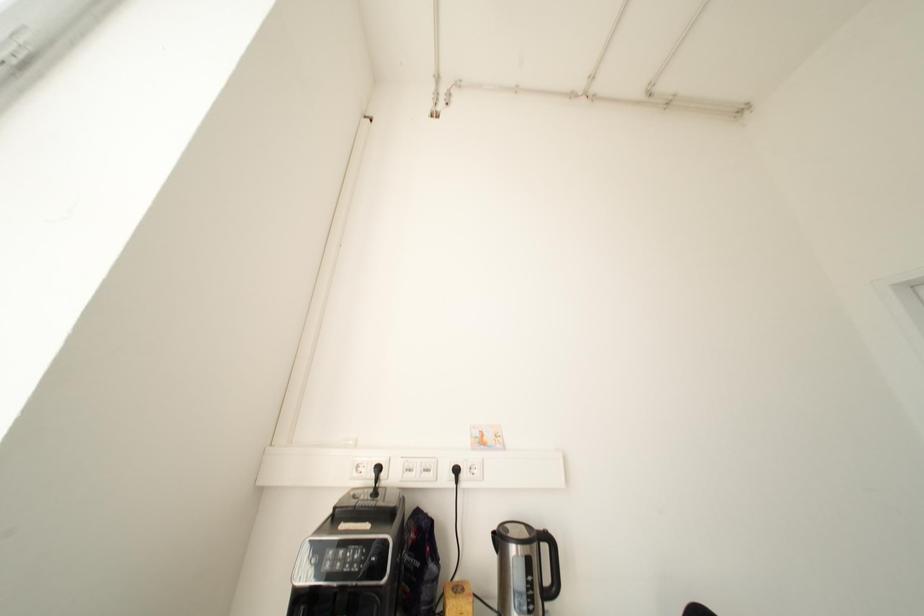
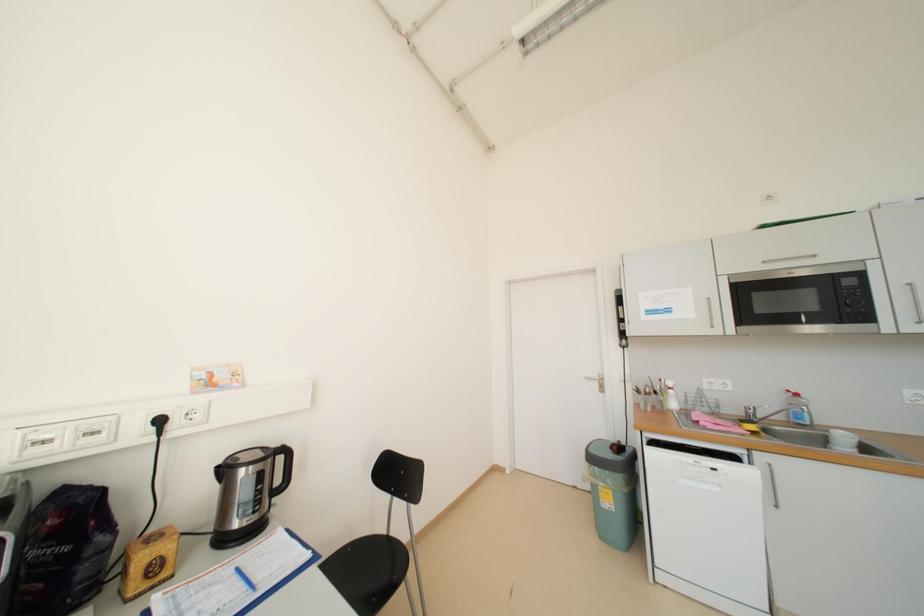
Question: The camera is either moving clockwise (left) or counter-clockwise (right) around the object. The first image is from the beginning of the video and the second image is from the end. Is the camera moving left or right when shooting the video?

Choices:
 (A) Left
 (B) Right

Answer: (A)